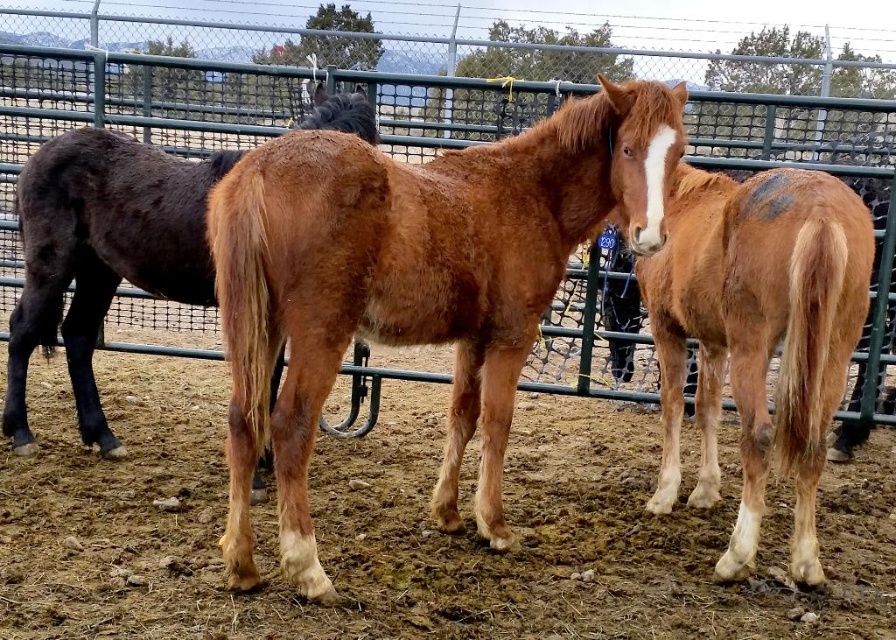
Question: Among these points, which one is farthest from the camera?

Choices:
 (A) (44, 262)
 (B) (390, 204)

Answer: (A)

Question: Which point appears farthest from the camera in this image?

Choices:
 (A) (461, 452)
 (B) (410, 140)
 (C) (95, 576)
 (D) (748, 548)

Answer: (B)

Question: Does brown fuzzy horse at center appear on the left side of brown fuzzy horse at right?

Choices:
 (A) no
 (B) yes

Answer: (B)

Question: Can you confirm if green metal fence at center is positioned to the left of brown fuzzy horse at right?

Choices:
 (A) yes
 (B) no

Answer: (A)

Question: Is green metal fence at center to the left of brown fuzzy horse at center from the viewer's perspective?

Choices:
 (A) yes
 (B) no

Answer: (A)

Question: Which point appears farthest from the camera in this image?

Choices:
 (A) (445, 216)
 (B) (350, 460)

Answer: (B)